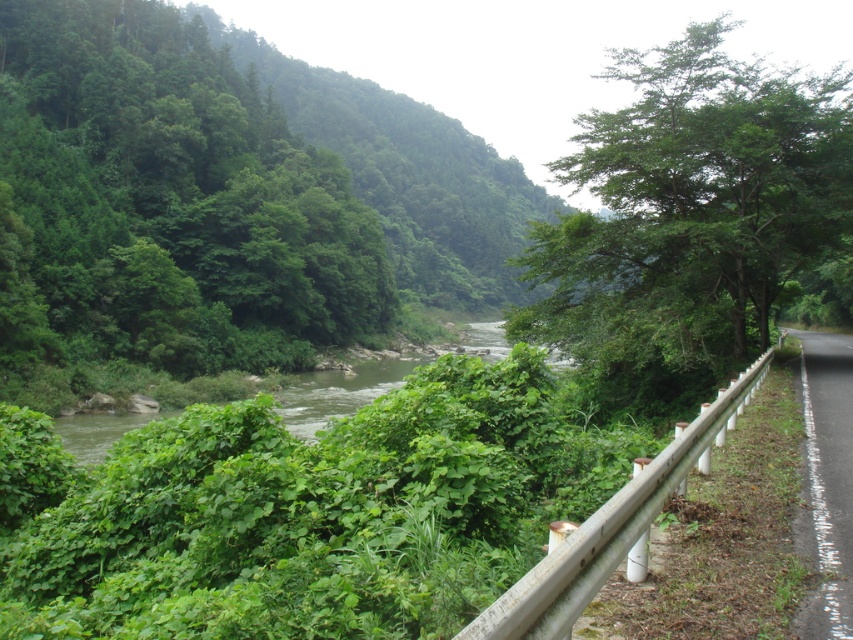
You are a hiker standing on the paved road bordered by a white guardrail on the right side of the image. You want to cross the green leafy river at center to reach the green leafy tree at left. Given that the tree is wider than the river, can you safely cross the river by walking directly towards the tree?

The green leafy tree at left is wider than the green leafy river at center, so the river is narrower than the tree. Since the river is narrower, it might be possible to cross it safely by walking directly towards the tree. However, the actual feasibility depends on the river depth and current, which are not specified in the scene description.

You are standing at the point closer to the viewer between the two points, point (x=241, y=252) and point (x=833, y=624). Which point are you standing at?

You are standing at point (x=241, y=252) because it is further to the viewer than point (x=833, y=624).

You are a hiker standing at the center of the image. You want to know which object, the green leafy tree at left or the white asphalt road at right, is wider. Which one is wider?

The green leafy tree at left is wider than the white asphalt road at right according to the description.